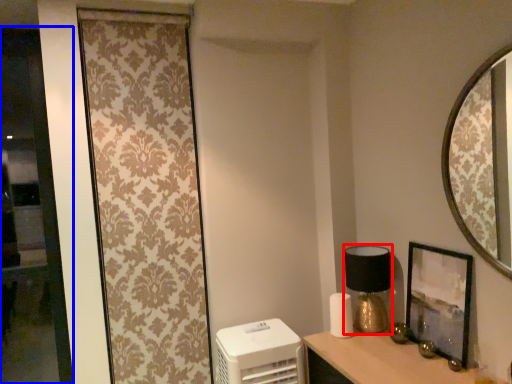
Question: Which object appears farthest to the camera in this image, table lamp (highlighted by a red box) or glass door (highlighted by a blue box)?

Choices:
 (A) table lamp
 (B) glass door

Answer: (B)